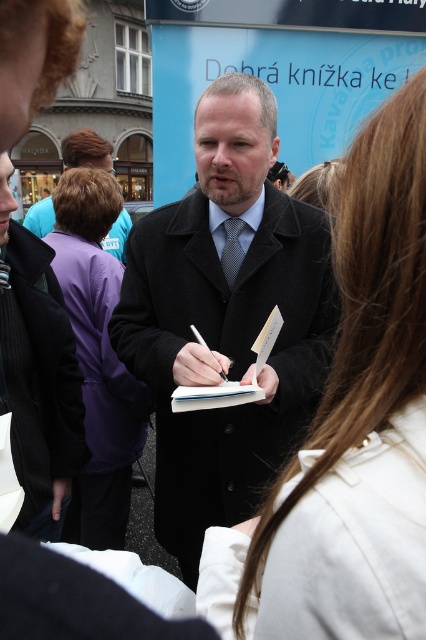
Is white fabric coat at center smaller than dark blue textured tie at center?

Actually, white fabric coat at center might be larger than dark blue textured tie at center.

Does point (215, 593) come closer to viewer compared to point (233, 269)?

Yes, it is.

This screenshot has width=426, height=640. In order to click on white fabric coat at center in this screenshot , I will do `click(351, 429)`.

Consider the image. Which of these two, dark gray wool coat at center or dark blue textured tie at center, stands shorter?

dark blue textured tie at center

Is point (264, 220) closer to camera compared to point (229, 243)?

Yes, it is in front of point (229, 243).

I want to click on dark gray wool coat at center, so click(226, 320).

Is white fabric coat at center bigger than purple fabric jacket at upper left?

Actually, white fabric coat at center might be smaller than purple fabric jacket at upper left.

The width and height of the screenshot is (426, 640). What do you see at coordinates (351, 429) in the screenshot?
I see `white fabric coat at center` at bounding box center [351, 429].

Find the location of `white fabric coat at center`. white fabric coat at center is located at coordinates (351, 429).